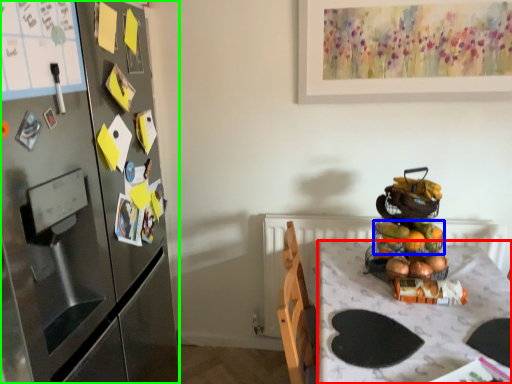
Question: Which is farther away from desk (highlighted by a red box)? basket (highlighted by a blue box) or cabinetry (highlighted by a green box)?

Choices:
 (A) basket
 (B) cabinetry

Answer: (B)